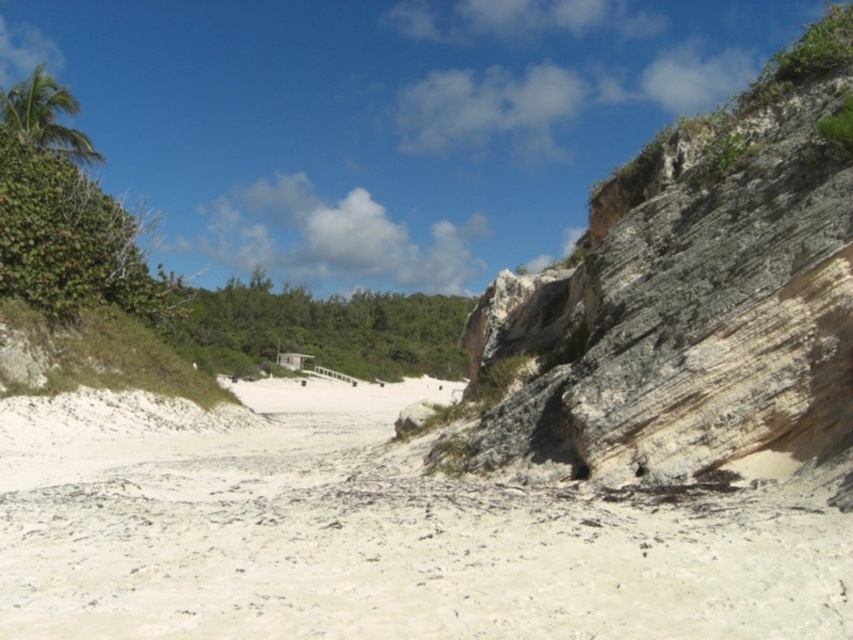
You are a hiker planning to walk from the gray rocky cliff at right to the green leafy shrubs at center. Given that your average walking speed is 3 km per hour, how long will it take you to reach the shrubs from the cliff?

The distance between the gray rocky cliff at right and the green leafy shrubs at center is 306.72 meters. Converting this to kilometers gives 0.30672 km. At a walking speed of 3 km per hour, the time required would be 0.30672 km divided by 3 km per hour, which equals approximately 0.10224 hours. Multiplying this by 60 minutes gives roughly 6.1344 minutes. Therefore, it will take approximately 6 minutes to reach the green leafy shrubs at center from the gray rocky cliff at right.

You are a hiker who wants to take a photo of both the gray rocky cliff at right and the green leafy bush at upper left in the same frame. Given that your camera has a maximum zoom range of 100 meters, will you be able to capture both objects in a single photo?

The gray rocky cliff at right and green leafy bush at upper left are 121.51 meters apart from each other. Since the camera can only zoom up to 100 meters, the distance between them exceeds the maximum zoom range. Therefore, you cannot capture both objects in a single photo.